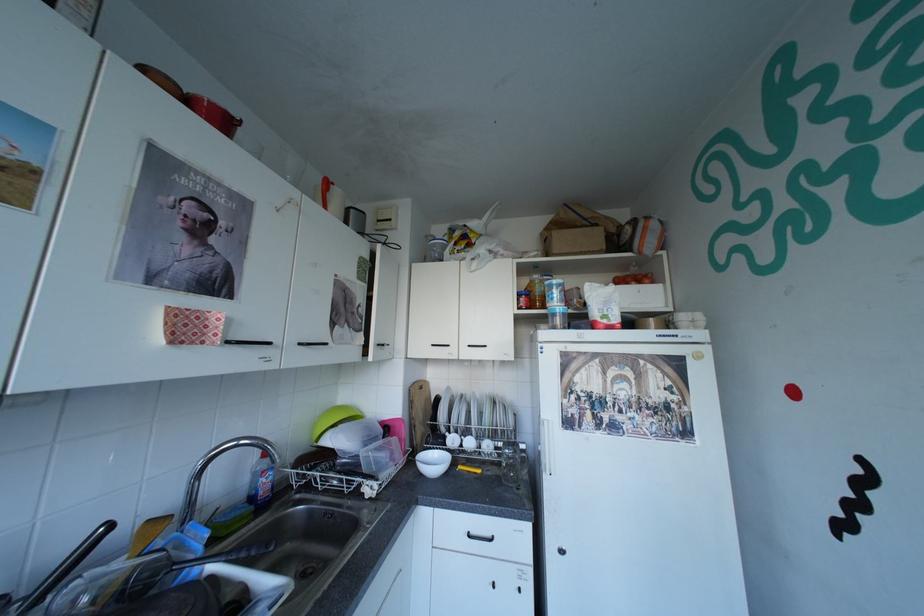
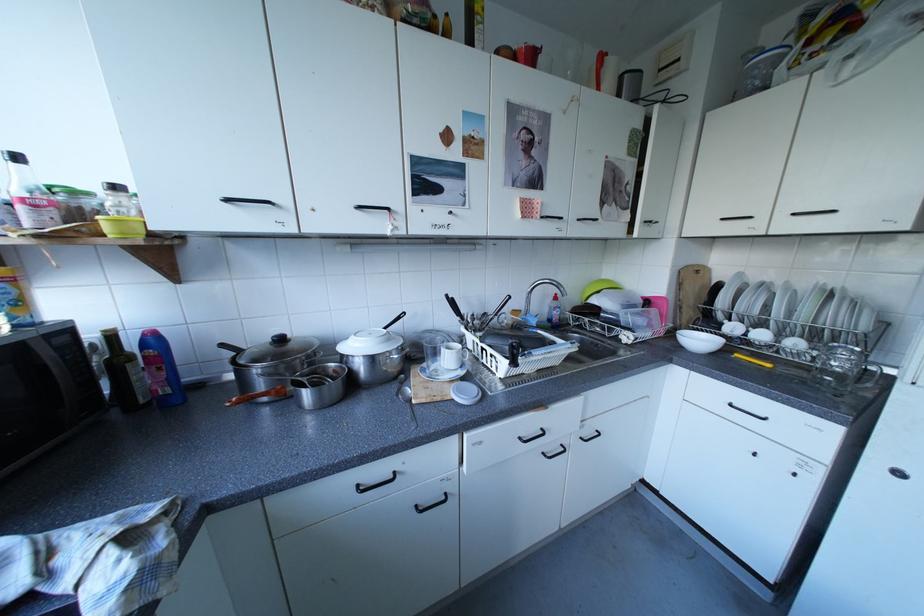
Find the pixel in the second image that matches [434,475] in the first image.

(694, 347)